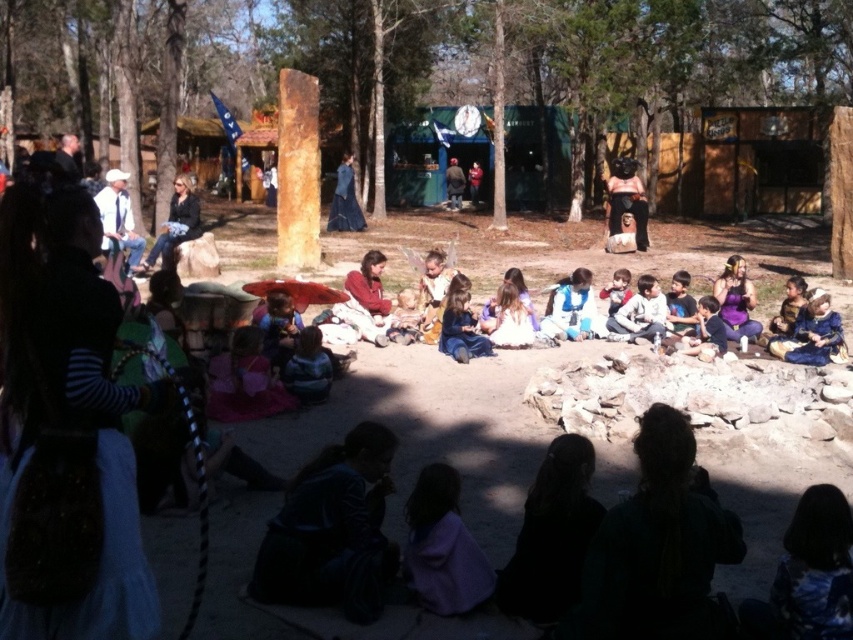
Question: Which point is closer to the camera taking this photo?

Choices:
 (A) (181, 193)
 (B) (457, 170)

Answer: (A)

Question: Based on their relative distances, which object is farther from the matte blue dress at center?

Choices:
 (A) blue fabric dress at center
 (B) matte black jacket at upper left

Answer: (A)

Question: Does pink fabric doll at center have a greater width compared to matte blue dress at center?

Choices:
 (A) yes
 (B) no

Answer: (B)

Question: Is pink fabric doll at center to the right of matte blue dress at center from the viewer's perspective?

Choices:
 (A) no
 (B) yes

Answer: (B)

Question: Can you confirm if matte black jacket at upper left is smaller than blue fabric dress at center?

Choices:
 (A) no
 (B) yes

Answer: (A)

Question: Based on their relative distances, which object is farther from the matte blue dress at center?

Choices:
 (A) blue fabric dress at center
 (B) pink fabric doll at center

Answer: (A)